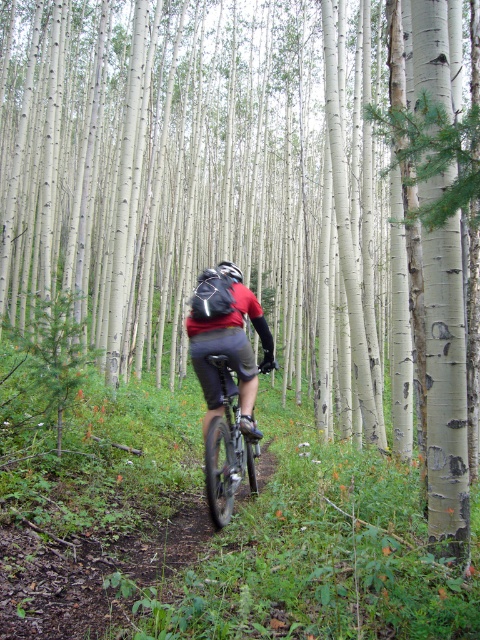
You are a photographer trying to capture a closeup shot of the matte black helmet at center and the shiny metallic bicycle at center. Your camera can only focus on objects within 10 inches of each other. Will you be able to get a clear photo of both objects at the same time?

The distance between the matte black helmet at center and the shiny metallic bicycle at center is 11.64 inches. Since the camera requires objects to be within 10 inches of each other for focus, the 11.64 inches distance exceeds this limit. Therefore, you won cannot capture both objects in focus simultaneously.